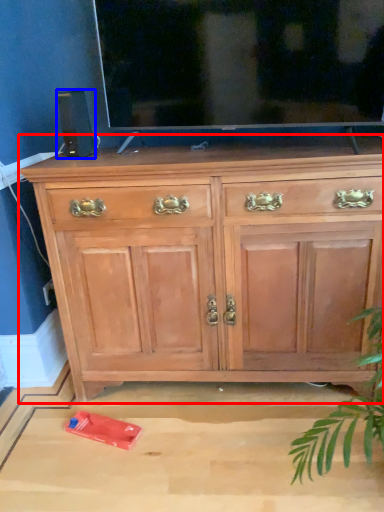
Question: Which object appears farthest to the camera in this image, chest of drawers (highlighted by a red box) or speaker (highlighted by a blue box)?

Choices:
 (A) chest of drawers
 (B) speaker

Answer: (B)